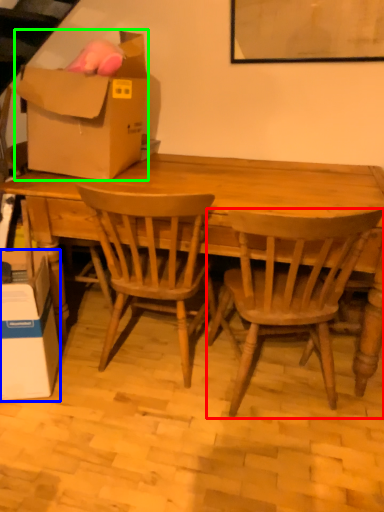
Question: Which is nearer to the chair (highlighted by a red box)? box (highlighted by a blue box) or box (highlighted by a green box).

Choices:
 (A) box
 (B) box

Answer: (B)